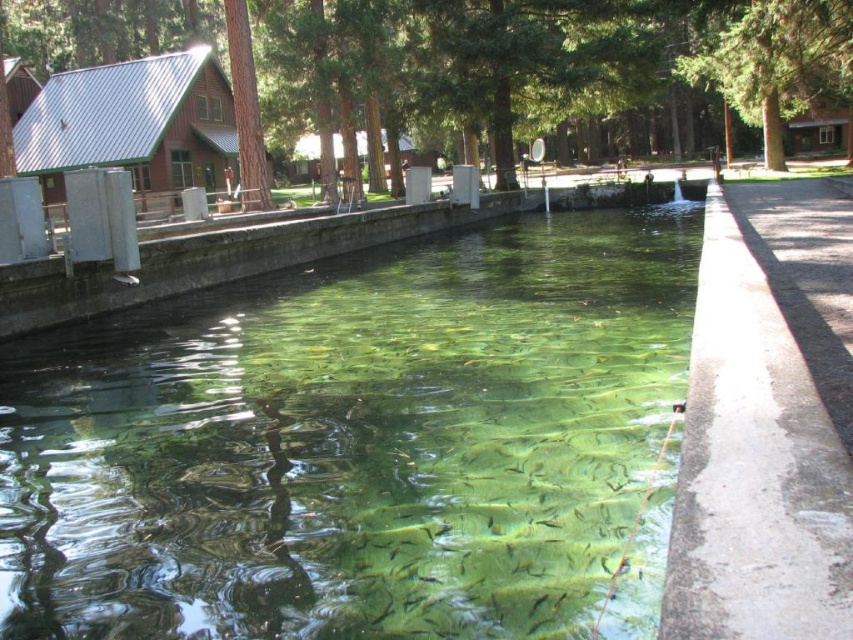
You are a painter standing at the edge of the pool. You want to paint both the green textured tree at upper center and the green rough bark tree at upper center. Which tree should you paint first if you want to start with the larger one?

You should paint the green textured tree at upper center first because it is bigger than the green rough bark tree at upper center.

You are standing at the edge of the pool and want to look up at both the green textured tree at upper center and the green rough bark tree at upper center. Which tree will you need to tilt your head back more to see the top of?

The green textured tree at upper center is much taller than the green rough bark tree at upper center, so you will need to tilt your head back more to see the top of the green textured tree at upper center.